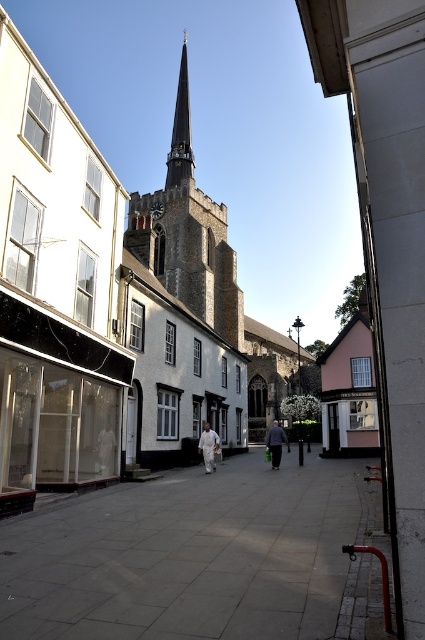
Question: Which object appears farthest from the camera in this image?

Choices:
 (A) gray concrete pavement at center
 (B) smooth gray spire at center

Answer: (B)

Question: Which object is closer to the camera taking this photo?

Choices:
 (A) smooth gray spire at center
 (B) gray concrete pavement at center
 (C) white fabric person at center
 (D) dark gray stone tower at center

Answer: (B)

Question: Among these objects, which one is farthest from the camera?

Choices:
 (A) smooth gray spire at center
 (B) white fabric person at center
 (C) dark gray fabric coat at center

Answer: (A)

Question: Is gray concrete pavement at center thinner than dark gray stone tower at center?

Choices:
 (A) yes
 (B) no

Answer: (A)

Question: Can you confirm if gray concrete pavement at center is positioned to the left of white fabric person at center?

Choices:
 (A) no
 (B) yes

Answer: (A)

Question: Where is dark gray stone tower at center located in relation to smooth gray spire at center in the image?

Choices:
 (A) above
 (B) below

Answer: (B)